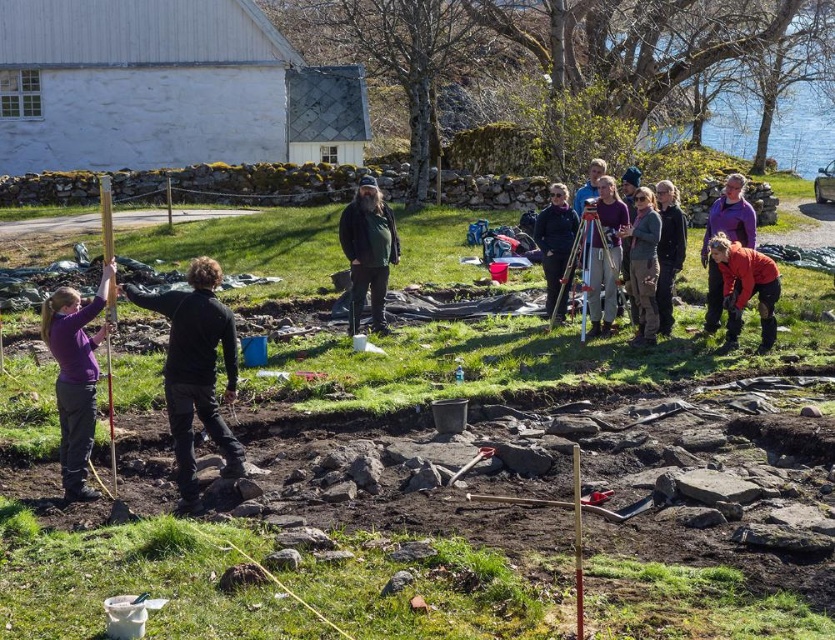
Which is in front, point (634, 195) or point (674, 225)?

Positioned in front is point (674, 225).

Find the location of a particular element. The width and height of the screenshot is (835, 640). dark gray sweater at center is located at coordinates (643, 264).

Does point (641, 304) come farther from viewer compared to point (671, 273)?

No, (641, 304) is closer to viewer.

The image size is (835, 640). I want to click on dark gray sweater at center, so click(643, 264).

Which is more to the right, purple matte shirt at center-left or dark brown leather jacket at center?

dark brown leather jacket at center is more to the right.

Describe the element at coordinates (74, 378) in the screenshot. I see `purple matte shirt at center-left` at that location.

Describe the element at coordinates (74, 378) in the screenshot. I see `purple matte shirt at center-left` at that location.

Where is `purple matte shirt at center-left`? The height and width of the screenshot is (640, 835). purple matte shirt at center-left is located at coordinates (74, 378).

Between black matte jacket at left and purple fleece jacket at center, which one has more height?

purple fleece jacket at center is taller.

Between black matte jacket at left and purple fleece jacket at center, which one has less height?

Standing shorter between the two is black matte jacket at left.

Where is `black matte jacket at left`? black matte jacket at left is located at coordinates (195, 371).